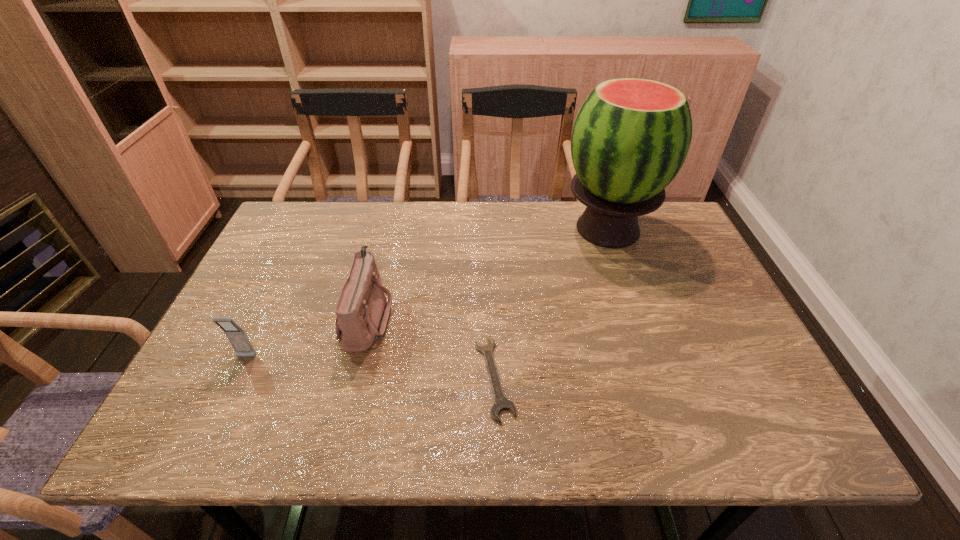
The height and width of the screenshot is (540, 960). Identify the location of object at the far edge. (631, 136).

Identify the location of object at the near edge. The width and height of the screenshot is (960, 540). (501, 403).

The height and width of the screenshot is (540, 960). I want to click on object that is at the left edge, so click(237, 337).

Locate an element on the screen. The image size is (960, 540). object that is positioned at the right edge is located at coordinates (631, 136).

At what (x,y) coordinates should I click in order to perform the action: click on object that is at the far right corner. Please return your answer as a coordinate pair (x, y). Looking at the image, I should click on (631, 136).

This screenshot has height=540, width=960. What are the coordinates of `free spot at the far edge of the desktop` in the screenshot? It's located at (345, 213).

Locate an element on the screen. vacant space at the near edge of the desktop is located at coordinates (420, 440).

This screenshot has width=960, height=540. In the image, there is a desktop. In order to click on vacant space at the left edge in this screenshot , I will do `click(238, 306)`.

Where is `vacant space at the right edge`? vacant space at the right edge is located at coordinates (688, 328).

This screenshot has width=960, height=540. I want to click on vacant space at the near left corner of the desktop, so 220,447.